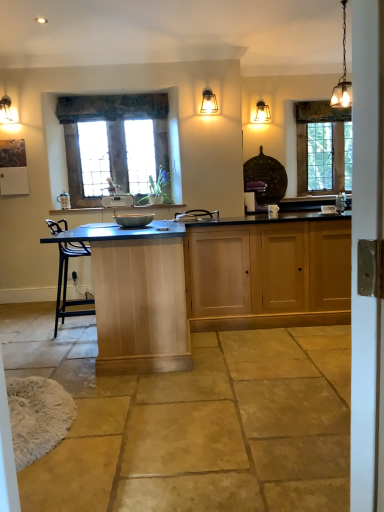
Question: Is the depth of textured fabric curtain at upper center less than that of metallic chain-link light fixture at upper right, arranged as the 3th light fixture when viewed from the back?

Choices:
 (A) no
 (B) yes

Answer: (A)

Question: Is textured fabric curtain at upper center not within metallic chain-link light fixture at upper right, arranged as the 1th light fixture when viewed from the front?

Choices:
 (A) no
 (B) yes

Answer: (B)

Question: From a real-world perspective, is textured fabric curtain at upper center positioned over metallic chain-link light fixture at upper right, arranged as the 3th light fixture when viewed from the back, based on gravity?

Choices:
 (A) no
 (B) yes

Answer: (A)

Question: Does textured fabric curtain at upper center appear on the right side of metallic chain-link light fixture at upper right, which is counted as the 3th light fixture, starting from the left?

Choices:
 (A) no
 (B) yes

Answer: (A)

Question: Is textured fabric curtain at upper center smaller than metallic chain-link light fixture at upper right, arranged as the 1th light fixture when viewed from the front?

Choices:
 (A) no
 (B) yes

Answer: (A)

Question: Is matte glass pendant light at upper center, positioned as the 1th light fixture in back-to-front order, wider or thinner than metallic gray bowl at center, acting as the 1th appliance starting from the front?

Choices:
 (A) wide
 (B) thin

Answer: (B)

Question: From a real-world perspective, is matte glass pendant light at upper center, which appears as the 2th light fixture when viewed from the right, physically located above or below metallic gray bowl at center, marked as the second appliance in a left-to-right arrangement?

Choices:
 (A) below
 (B) above

Answer: (B)

Question: Looking at the image, does matte glass pendant light at upper center, arranged as the 2th light fixture when viewed from the left, seem bigger or smaller compared to metallic gray bowl at center, positioned as the second appliance in back-to-front order?

Choices:
 (A) big
 (B) small

Answer: (A)

Question: Is matte glass pendant light at upper center, positioned as the 1th light fixture in back-to-front order, in front of or behind metallic gray bowl at center, acting as the 1th appliance starting from the front, in the image?

Choices:
 (A) behind
 (B) front

Answer: (A)

Question: Looking at their shapes, would you say stained glass window at upper right, which appears as the first window when viewed from the right, is wider or thinner than light wood cabinet at center, marked as the 2th cabinetry in a right-to-left arrangement?

Choices:
 (A) thin
 (B) wide

Answer: (A)

Question: Visually, is stained glass window at upper right, marked as the 2th window in a left-to-right arrangement, positioned to the left or to the right of light wood cabinet at center, marked as the 2th cabinetry in a right-to-left arrangement?

Choices:
 (A) left
 (B) right

Answer: (B)

Question: From the image's perspective, is stained glass window at upper right, marked as the 2th window in a left-to-right arrangement, located above or below light wood cabinet at center, positioned as the 1th cabinetry in left-to-right order?

Choices:
 (A) below
 (B) above

Answer: (B)

Question: Would you say stained glass window at upper right, marked as the 2th window in a left-to-right arrangement, is inside or outside light wood cabinet at center, marked as the 2th cabinetry in a right-to-left arrangement?

Choices:
 (A) inside
 (B) outside

Answer: (B)

Question: From their relative heights in the image, would you say white plastic radio at center, which is counted as the second appliance, starting from the right, is taller or shorter than stained glass window at center, which is counted as the first window, starting from the front?

Choices:
 (A) short
 (B) tall

Answer: (A)

Question: Considering their positions, is white plastic radio at center, which appears as the 2th appliance when ordered from the bottom, located in front of or behind stained glass window at center, marked as the 1th window in a left-to-right arrangement?

Choices:
 (A) behind
 (B) front

Answer: (B)